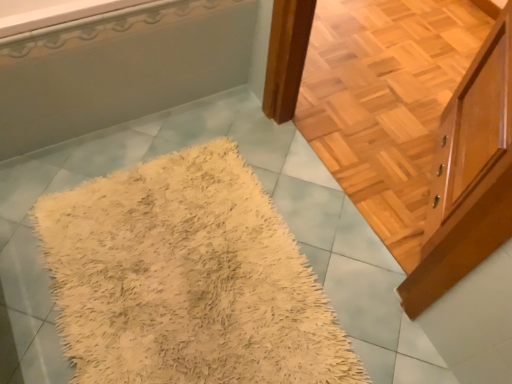
Question: Is the depth of white glossy bathtub at upper left less than that of beige shaggy rug at center?

Choices:
 (A) no
 (B) yes

Answer: (A)

Question: From the image's perspective, is white glossy bathtub at upper left over beige shaggy rug at center?

Choices:
 (A) no
 (B) yes

Answer: (B)

Question: Is the position of white glossy bathtub at upper left more distant than that of beige shaggy rug at center?

Choices:
 (A) no
 (B) yes

Answer: (B)

Question: Would you say white glossy bathtub at upper left is a long distance from beige shaggy rug at center?

Choices:
 (A) no
 (B) yes

Answer: (A)

Question: Could you tell me if white glossy bathtub at upper left is turned towards beige shaggy rug at center?

Choices:
 (A) no
 (B) yes

Answer: (B)

Question: From a real-world perspective, is white glossy bathtub at upper left positioned under beige shaggy rug at center based on gravity?

Choices:
 (A) yes
 (B) no

Answer: (B)

Question: Does light brown wood cabinet at upper right have a larger size compared to white glossy bathtub at upper left?

Choices:
 (A) no
 (B) yes

Answer: (A)

Question: Considering the relative positions of light brown wood cabinet at upper right and white glossy bathtub at upper left in the image provided, is light brown wood cabinet at upper right to the left of white glossy bathtub at upper left from the viewer's perspective?

Choices:
 (A) yes
 (B) no

Answer: (B)

Question: Considering the relative sizes of light brown wood cabinet at upper right and white glossy bathtub at upper left in the image provided, is light brown wood cabinet at upper right smaller than white glossy bathtub at upper left?

Choices:
 (A) yes
 (B) no

Answer: (A)

Question: Is light brown wood cabinet at upper right oriented towards white glossy bathtub at upper left?

Choices:
 (A) yes
 (B) no

Answer: (A)

Question: Is light brown wood cabinet at upper right beside white glossy bathtub at upper left?

Choices:
 (A) yes
 (B) no

Answer: (B)

Question: Does light brown wood cabinet at upper right come behind white glossy bathtub at upper left?

Choices:
 (A) yes
 (B) no

Answer: (B)

Question: Is light brown wood cabinet at upper right next to beige shaggy rug at center and touching it?

Choices:
 (A) yes
 (B) no

Answer: (B)